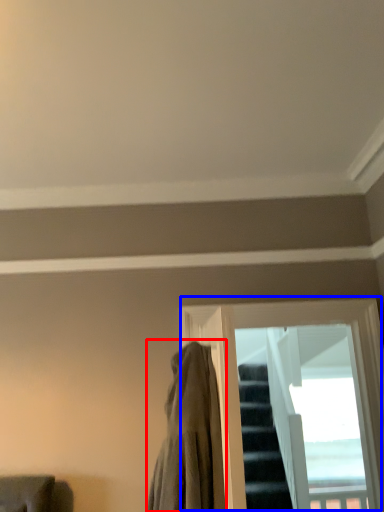
Question: Which point is closer to the camera, cloak (highlighted by a red box) or window (highlighted by a blue box)?

Choices:
 (A) cloak
 (B) window

Answer: (A)